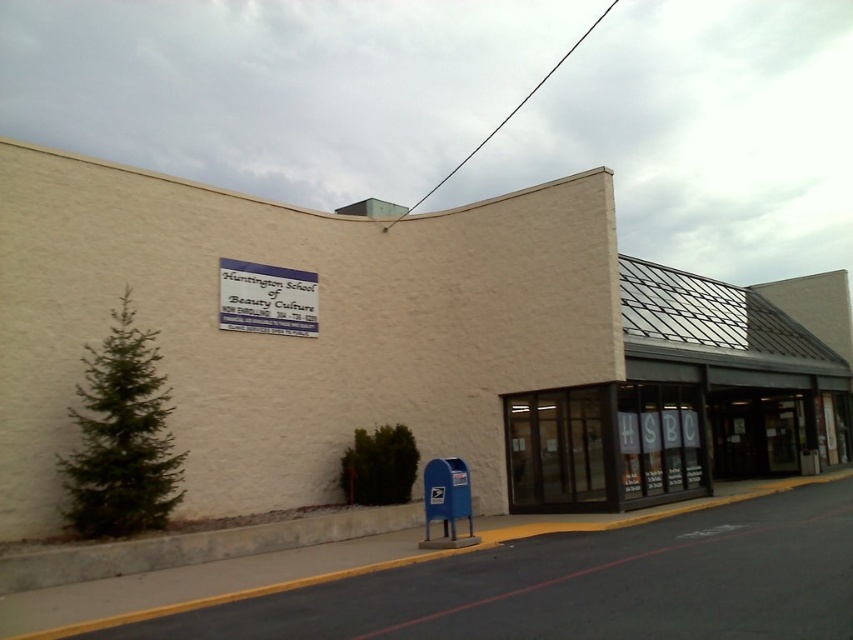
You are standing at the point marked by the coordinates point at (549, 417) in front of the Huntington School of Beauty Culture. You want to walk to the entrance of the building. How far will you have to walk?

The point marked by the coordinates point at (549, 417) is 51.66 feet away from the viewer, so you will have to walk 51.66 feet to reach the entrance of the building.

You are standing in front of the Huntington School of Beauty Culture building. You see a point marked at coordinates point [646,442]. Where exactly is this point located?

The point [646,442] is located on the clear glass storefront at lower right.

You are a delivery person approaching the Huntington School of Beauty Culture. You need to place a package inside the clear glass storefront at lower right and the blue plastic sign at upper center. Which object is taller so you know where to look first?

The clear glass storefront at lower right is much taller than the blue plastic sign at upper center, so you should look at the clear glass storefront at lower right first.